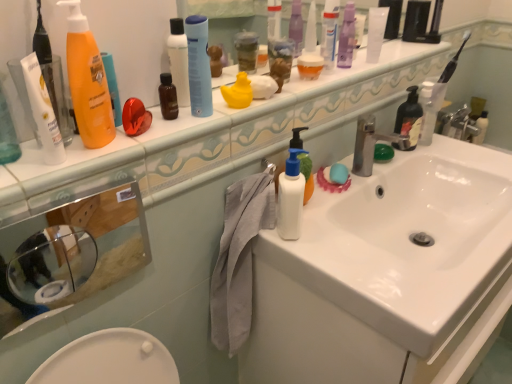
Where is `vacant area in front of translucent plastic container at upper center, positioned as the 5th toiletry in right-to-left order`? The width and height of the screenshot is (512, 384). vacant area in front of translucent plastic container at upper center, positioned as the 5th toiletry in right-to-left order is located at coordinates (289, 94).